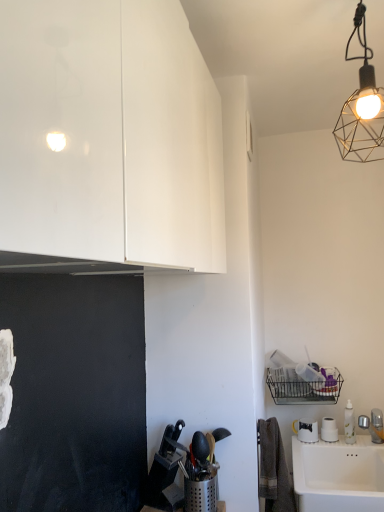
This screenshot has width=384, height=512. What do you see at coordinates (338, 475) in the screenshot?
I see `white ceramic sink at lower right` at bounding box center [338, 475].

In order to click on glossy white cabinet at upper left in this screenshot , I will do `click(108, 139)`.

Find the location of `white ceramic sink at lower right`. white ceramic sink at lower right is located at coordinates (338, 475).

How different are the orientations of white ceramic sink at lower right and metallic wire mesh at upper right in degrees?

0.531 degrees separate the facing orientations of white ceramic sink at lower right and metallic wire mesh at upper right.

Which is behind, point (318, 474) or point (359, 149)?

The point (318, 474) is behind.

Does white ceramic sink at lower right have a lesser width compared to metallic wire mesh at upper right?

No, white ceramic sink at lower right is not thinner than metallic wire mesh at upper right.

Is metallic wire mesh at upper right smaller than white ceramic sink at lower right?

Yes.

Are metallic wire mesh at upper right and white ceramic sink at lower right beside each other?

There is a gap between metallic wire mesh at upper right and white ceramic sink at lower right.

Is point (382, 99) closer to viewer compared to point (302, 444)?

Yes, point (382, 99) is closer to viewer.

From a real-world perspective, is metallic wire mesh at upper right below white ceramic sink at lower right?

No.

Would you consider metallic wire mesh at upper right to be distant from glossy white cabinet at upper left?

That's not correct — metallic wire mesh at upper right is a little close to glossy white cabinet at upper left.

Between metallic wire mesh at upper right and glossy white cabinet at upper left, which one has larger size?

glossy white cabinet at upper left is bigger.

Is metallic wire mesh at upper right facing away from glossy white cabinet at upper left?

That's not correct — metallic wire mesh at upper right is not looking away from glossy white cabinet at upper left.

Can you tell me how much metallic wire mesh at upper right and glossy white cabinet at upper left differ in facing direction?

89 degrees separate the facing orientations of metallic wire mesh at upper right and glossy white cabinet at upper left.

Where is `sink that appears behind the glossy white cabinet at upper left`? sink that appears behind the glossy white cabinet at upper left is located at coordinates (338, 475).

Between glossy white cabinet at upper left and white ceramic sink at lower right, which one appears on the right side from the viewer's perspective?

Positioned to the right is white ceramic sink at lower right.

Does glossy white cabinet at upper left have a greater width compared to white ceramic sink at lower right?

No, glossy white cabinet at upper left is not wider than white ceramic sink at lower right.

How different are the orientations of glossy white cabinet at upper left and white ceramic sink at lower right in degrees?

There is a 88.4-degree angle between the facing directions of glossy white cabinet at upper left and white ceramic sink at lower right.

In the scene shown: Does white ceramic sink at lower right appear on the right side of glossy white cabinet at upper left?

Yes, white ceramic sink at lower right is to the right of glossy white cabinet at upper left.

Based on the photo, from a real-world perspective, does white ceramic sink at lower right sit lower than glossy white cabinet at upper left?

Yes, from a real-world perspective, white ceramic sink at lower right is under glossy white cabinet at upper left.

Is white ceramic sink at lower right taller than glossy white cabinet at upper left?

Incorrect, the height of white ceramic sink at lower right is not larger of that of glossy white cabinet at upper left.

Who is bigger, white ceramic sink at lower right or glossy white cabinet at upper left?

Bigger between the two is glossy white cabinet at upper left.

From a real-world perspective, is glossy white cabinet at upper left physically located above or below metallic wire mesh at upper right?

From a real-world perspective, glossy white cabinet at upper left is physically below metallic wire mesh at upper right.

How much distance is there between glossy white cabinet at upper left and metallic wire mesh at upper right?

glossy white cabinet at upper left and metallic wire mesh at upper right are 29.88 inches apart from each other.

Considering the sizes of objects glossy white cabinet at upper left and metallic wire mesh at upper right in the image provided, who is smaller, glossy white cabinet at upper left or metallic wire mesh at upper right?

Smaller between the two is metallic wire mesh at upper right.

Is glossy white cabinet at upper left oriented towards metallic wire mesh at upper right?

Yes, glossy white cabinet at upper left is oriented towards metallic wire mesh at upper right.

The height and width of the screenshot is (512, 384). In order to click on sink that appears below the metallic wire mesh at upper right (from a real-world perspective) in this screenshot , I will do pyautogui.click(x=338, y=475).

Locate an element on the screen. sink to the right of metallic wire mesh at upper right is located at coordinates (338, 475).

Based on their spatial positions, is glossy white cabinet at upper left or white ceramic sink at lower right further from metallic wire mesh at upper right?

Among the two, white ceramic sink at lower right is located further to metallic wire mesh at upper right.

Looking at the image, which one is located closer to white ceramic sink at lower right, glossy white cabinet at upper left or metallic wire mesh at upper right?

metallic wire mesh at upper right lies closer to white ceramic sink at lower right than the other object.

From the image, which object appears to be nearer to glossy white cabinet at upper left, metallic wire mesh at upper right or white ceramic sink at lower right?

metallic wire mesh at upper right lies closer to glossy white cabinet at upper left than the other object.

In the scene shown: Based on their spatial positions, is metallic wire mesh at upper right or glossy white cabinet at upper left closer to white ceramic sink at lower right?

metallic wire mesh at upper right is closer to white ceramic sink at lower right.

Looking at the image, which one is located further to metallic wire mesh at upper right, white ceramic sink at lower right or glossy white cabinet at upper left?

The object further to metallic wire mesh at upper right is white ceramic sink at lower right.

Which object lies nearer to the anchor point glossy white cabinet at upper left, white ceramic sink at lower right or metallic wire mesh at upper right?

Among the two, metallic wire mesh at upper right is located nearer to glossy white cabinet at upper left.

What are the coordinates of `cabinetry between metallic wire mesh at upper right and white ceramic sink at lower right vertically` in the screenshot? It's located at (108, 139).